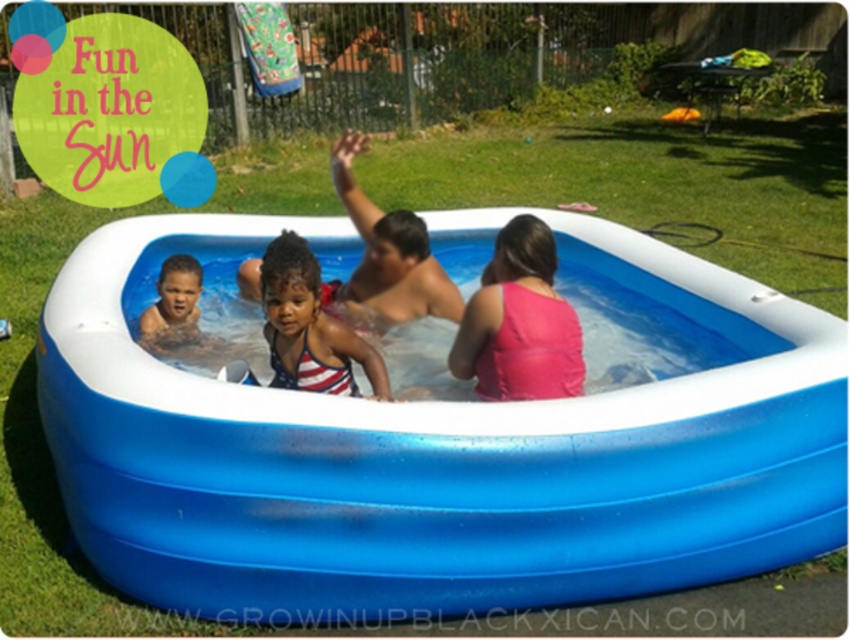
Question: Is blue rubber pool at center positioned at the back of american flag swimsuit at center?

Choices:
 (A) yes
 (B) no

Answer: (B)

Question: Which object is farther from the camera taking this photo?

Choices:
 (A) matte black baby at center
 (B) american flag swimsuit at center
 (C) pink fabric swimsuit at center
 (D) blue rubber pool at center

Answer: (A)

Question: Estimate the real-world distances between objects in this image. Which object is closer to the american flag swimsuit at center?

Choices:
 (A) blue rubber pool at center
 (B) matte black baby at center
 (C) pink fabric swimsuit at center

Answer: (C)

Question: Does pink fabric swimsuit at center have a larger size compared to american flag swimsuit at center?

Choices:
 (A) no
 (B) yes

Answer: (B)

Question: Can you confirm if american flag swimsuit at center is positioned to the left of matte black baby at center?

Choices:
 (A) no
 (B) yes

Answer: (A)

Question: Which point appears closest to the camera in this image?

Choices:
 (A) (357, 360)
 (B) (463, 316)
 (C) (159, 282)

Answer: (A)